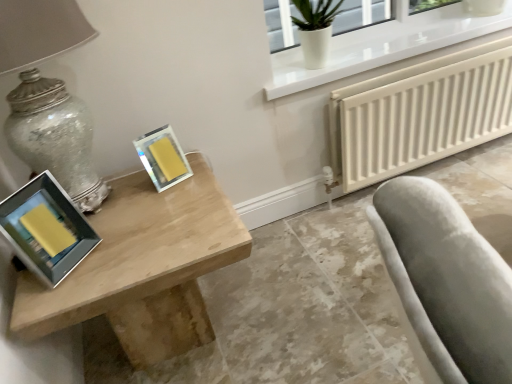
Where is `vacant area that lies in front of yellow matte picture frame at upper center, which is counted as the 1th picture frame, starting from the right`? vacant area that lies in front of yellow matte picture frame at upper center, which is counted as the 1th picture frame, starting from the right is located at coordinates (163, 206).